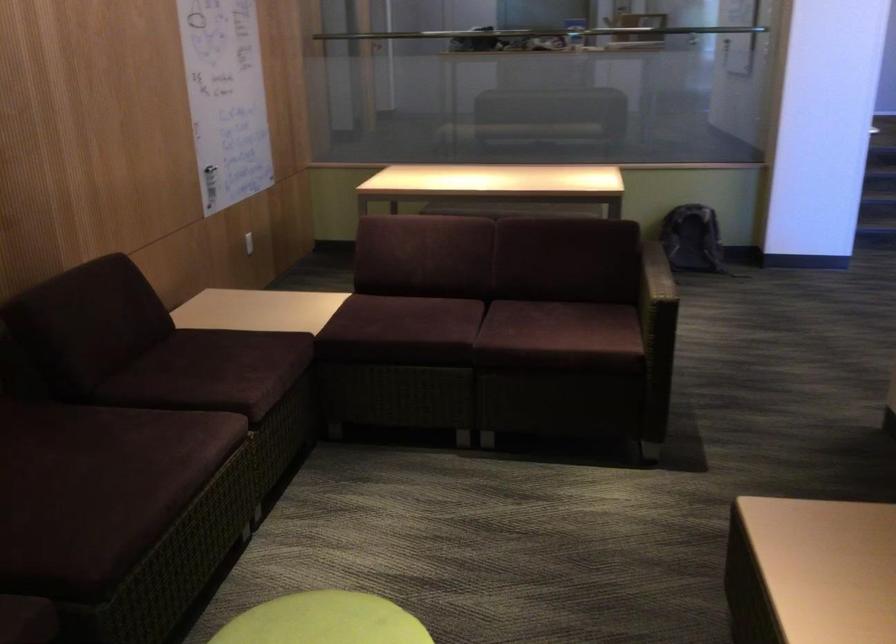
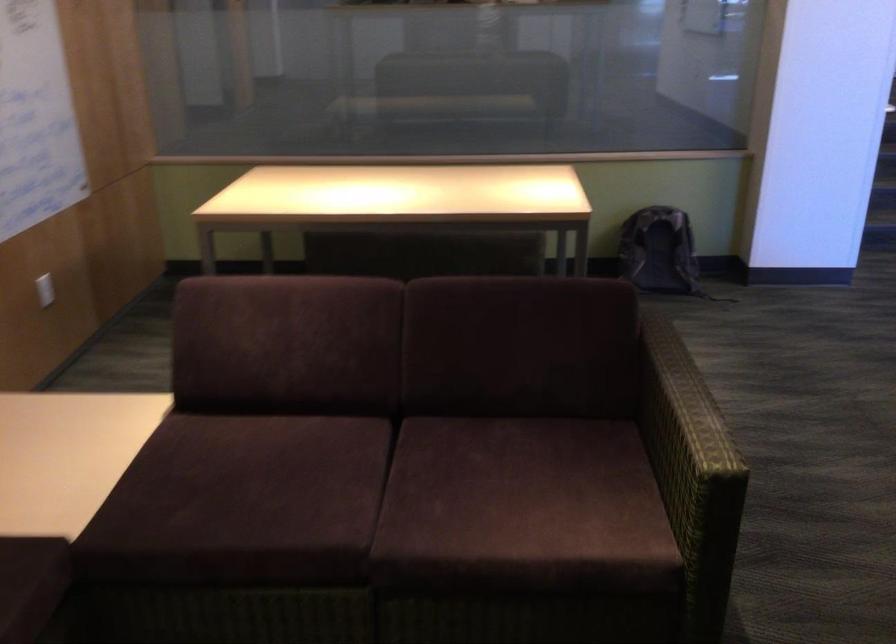
In the second image, find the point that corresponds to pixel 416 316 in the first image.

(269, 476)